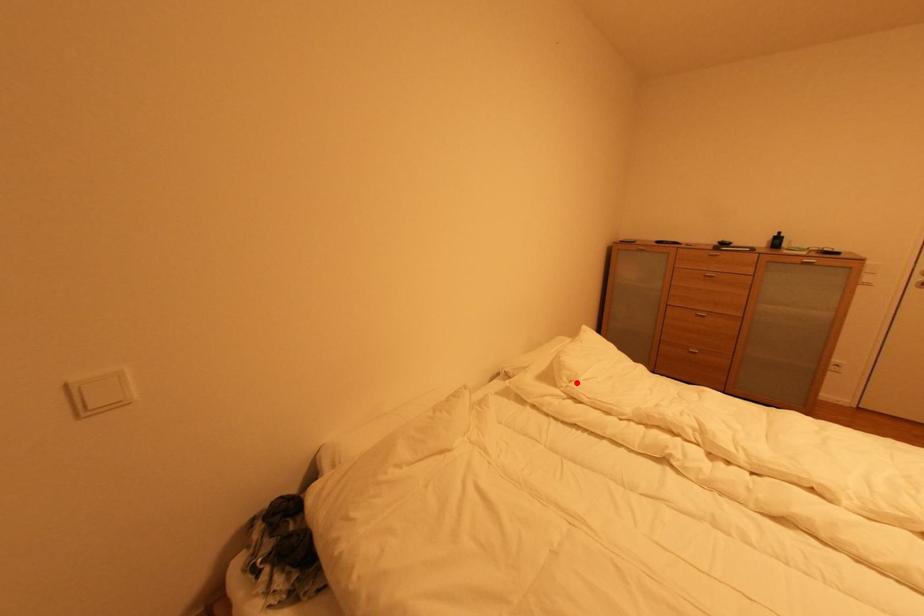
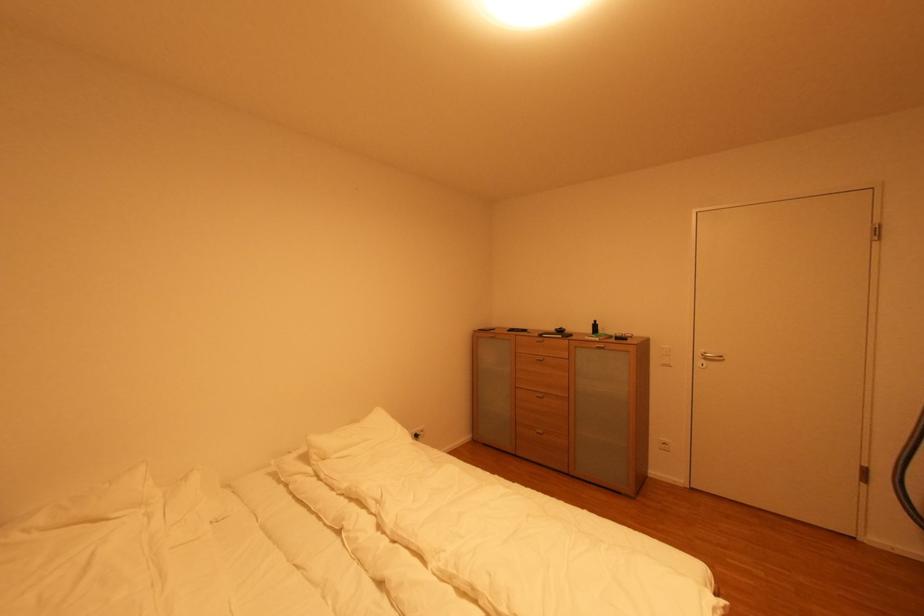
Locate, in the second image, the point that corresponds to the highlighted location in the first image.

(330, 461)